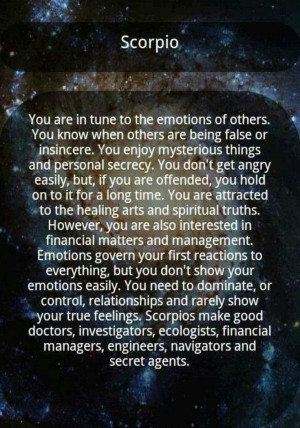
Locate an element on the screen. Image resolution: width=300 pixels, height=428 pixels. light is located at coordinates (239, 78).